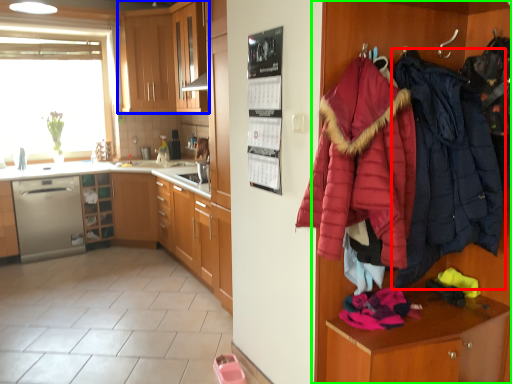
Question: Based on their relative distances, which object is farther from jacket (highlighted by a red box)? Choose from cabinetry (highlighted by a blue box) and dresser (highlighted by a green box).

Choices:
 (A) cabinetry
 (B) dresser

Answer: (A)